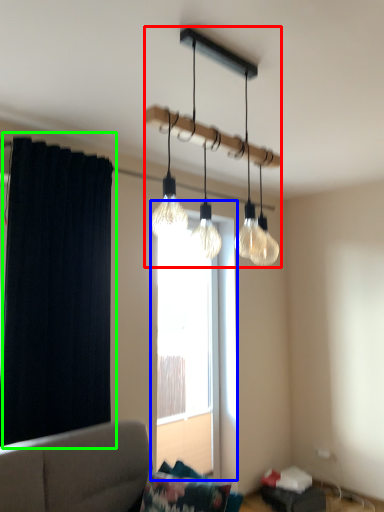
Question: Which object is the farthest from lamp (highlighted by a red box)? Choose among these: window (highlighted by a blue box) or curtain (highlighted by a green box).

Choices:
 (A) window
 (B) curtain

Answer: (A)